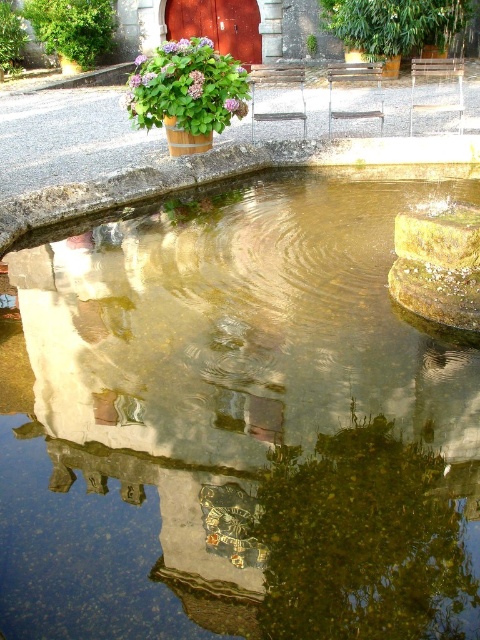
Question: Which of the following is the farthest from the observer?

Choices:
 (A) (19, 515)
 (B) (67, 6)

Answer: (B)

Question: Is clear water at center thinner than green leafy tree at upper left?

Choices:
 (A) yes
 (B) no

Answer: (B)

Question: Is green bamboo at upper right to the left of green leafy tree at upper left from the viewer's perspective?

Choices:
 (A) yes
 (B) no

Answer: (B)

Question: Is clear water at center below green bamboo at upper right?

Choices:
 (A) no
 (B) yes

Answer: (B)

Question: Which of the following is the farthest from the observer?

Choices:
 (A) (76, 12)
 (B) (385, 64)

Answer: (A)

Question: Which object appears closest to the camera in this image?

Choices:
 (A) clear water at center
 (B) green leafy tree at upper left
 (C) green bamboo at upper right

Answer: (A)